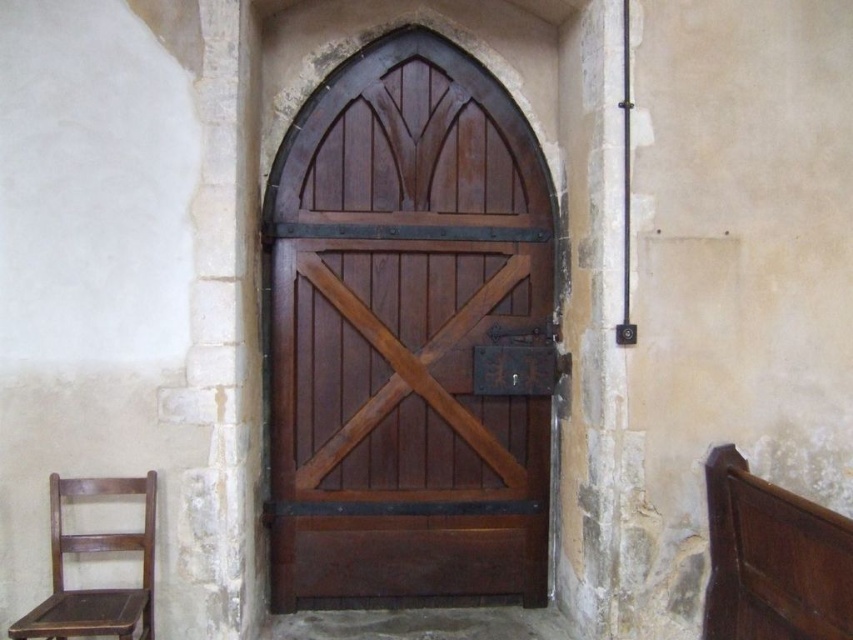
Question: Is satin wood door at center positioned in front of wooden chair at left?

Choices:
 (A) no
 (B) yes

Answer: (A)

Question: Which of the following is the closest to the observer?

Choices:
 (A) satin wood door at center
 (B) wooden chair at left

Answer: (B)

Question: Which point is closer to the camera?

Choices:
 (A) satin wood door at center
 (B) wooden chair at left

Answer: (B)

Question: Is satin wood door at center in front of wooden chair at left?

Choices:
 (A) no
 (B) yes

Answer: (A)

Question: Is satin wood door at center above wooden chair at left?

Choices:
 (A) no
 (B) yes

Answer: (B)

Question: Which point appears farthest from the camera in this image?

Choices:
 (A) (73, 632)
 (B) (428, 218)

Answer: (B)